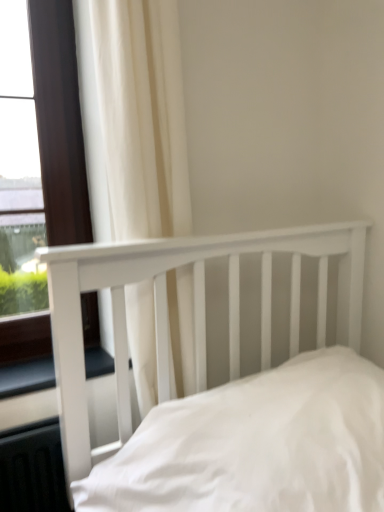
Question: Is matte brown window at left positioned in front of black rubber window sill at lower left?

Choices:
 (A) yes
 (B) no

Answer: (B)

Question: Is matte brown window at left surrounding black rubber window sill at lower left?

Choices:
 (A) yes
 (B) no

Answer: (B)

Question: Is black rubber window sill at lower left at the back of matte brown window at left?

Choices:
 (A) no
 (B) yes

Answer: (A)

Question: Is matte brown window at left next to black rubber window sill at lower left?

Choices:
 (A) yes
 (B) no

Answer: (B)

Question: From the image's perspective, is matte brown window at left beneath black rubber window sill at lower left?

Choices:
 (A) no
 (B) yes

Answer: (A)

Question: Is white fabric curtain at upper left taller or shorter than white wooden bed at center?

Choices:
 (A) tall
 (B) short

Answer: (A)

Question: From a real-world perspective, is white fabric curtain at upper left physically located above or below white wooden bed at center?

Choices:
 (A) below
 (B) above

Answer: (B)

Question: Visually, is white fabric curtain at upper left positioned to the left or to the right of white wooden bed at center?

Choices:
 (A) right
 (B) left

Answer: (B)

Question: From the image's perspective, is white fabric curtain at upper left above or below white wooden bed at center?

Choices:
 (A) below
 (B) above

Answer: (B)

Question: Is black rubber window sill at lower left wider or thinner than white wooden bed at center?

Choices:
 (A) wide
 (B) thin

Answer: (B)

Question: Based on their positions, is black rubber window sill at lower left located to the left or right of white wooden bed at center?

Choices:
 (A) right
 (B) left

Answer: (B)

Question: Does point (114, 424) appear closer or farther from the camera than point (251, 337)?

Choices:
 (A) farther
 (B) closer

Answer: (B)

Question: From a real-world perspective, is black rubber window sill at lower left physically located above or below white wooden bed at center?

Choices:
 (A) below
 (B) above

Answer: (A)

Question: Is black rubber window sill at lower left spatially inside matte brown window at left, or outside of it?

Choices:
 (A) outside
 (B) inside

Answer: (A)

Question: Looking at their shapes, would you say black rubber window sill at lower left is wider or thinner than matte brown window at left?

Choices:
 (A) thin
 (B) wide

Answer: (B)